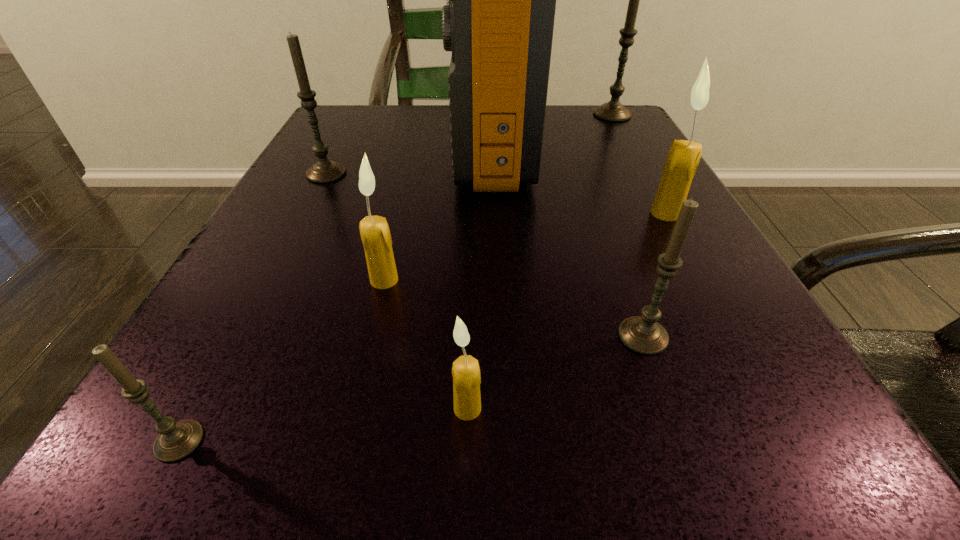
The width and height of the screenshot is (960, 540). In order to click on vacant area situated 0.320m on the front of the farthest cream candle in this screenshot , I will do `click(776, 411)`.

Find the location of a particular element. The width and height of the screenshot is (960, 540). free spot located 0.390m on the back of the second smallest cream candle is located at coordinates (418, 140).

Locate an element on the screen. free region located 0.290m on the left of the third object from right to left is located at coordinates (362, 336).

Find the location of a particular element. vacant space located on the back of the nearest candle is located at coordinates point(297,221).

Locate an element on the screen. vacant space located 0.270m on the back of the fourth candle from left to right is located at coordinates (471, 234).

This screenshot has height=540, width=960. Find the location of `radio receiver at the far edge`. radio receiver at the far edge is located at coordinates (498, 22).

This screenshot has width=960, height=540. I want to click on candle positioned at the far edge, so click(614, 111).

Identify the location of object present at the near left corner. The image size is (960, 540). (176, 440).

Locate an element on the screen. This screenshot has width=960, height=540. object located at the far right corner is located at coordinates (614, 111).

In the image, there is a desktop. At what (x,y) coordinates should I click in order to perform the action: click on vacant space at the near edge. Please return your answer as a coordinate pair (x, y). The width and height of the screenshot is (960, 540). Looking at the image, I should click on (332, 481).